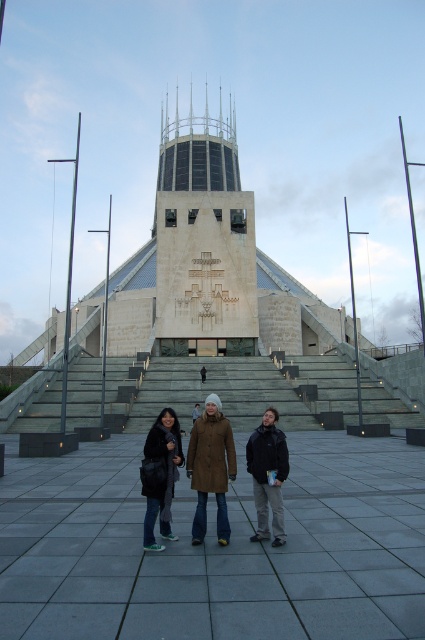
You are standing in front of the cathedral and see a brown leather jacket at center and a dark brown fur coat at lower center. Which item is closer to the entrance steps?

The dark brown fur coat at lower center is closer to the entrance steps because it is positioned lower than the brown leather jacket at center.

You are a fashion designer observing the modern architectural structure and notice two coats in the scene. Which coat would require more fabric to produce, the brown leather jacket at center or the dark brown fur coat at lower center?

The brown leather jacket at center has a larger size compared to the dark brown fur coat at lower center, so it would require more fabric to produce.

You are standing at the entrance of the modern architectural structure described. You notice a point marked at coordinates (x=218, y=392). Based on the scene, what does this point most likely represent?

The point at (x=218, y=392) corresponds to the gray concrete stairs at center, which are the main entrance steps leading up to the cathedral.